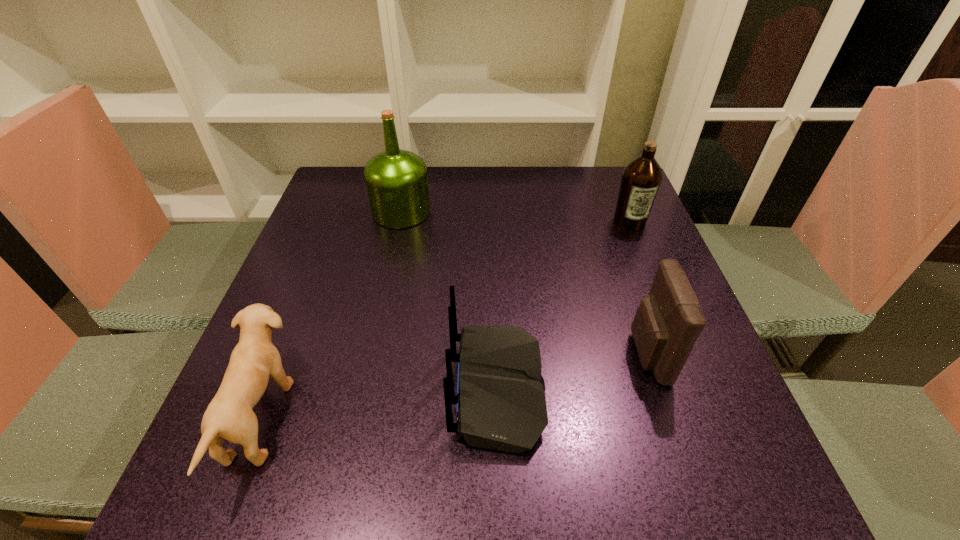
Point out which object is positioned as the second nearest to the third object from left to right. Please provide its 2D coordinates. Your answer should be formatted as a tuple, i.e. [(x, y)], where the tuple contains the x and y coordinates of a point satisfying the conditions above.

[(229, 415)]

You are a GUI agent. You are given a task and a screenshot of the screen. Output one action in this format:
    pyautogui.click(x=<x>, y=<y>)
    Task: Click on the object that is the fourth nearest to the shorter olive oil
    Image resolution: width=960 pixels, height=540 pixels.
    Given the screenshot: What is the action you would take?
    pyautogui.click(x=229, y=415)

This screenshot has height=540, width=960. I want to click on vacant point that satisfies the following two spatial constraints: 1. on the label of the right olive oil; 2. on the back of the router, so click(697, 389).

Image resolution: width=960 pixels, height=540 pixels. I want to click on free space that satisfies the following two spatial constraints: 1. on the label of the shorter olive oil; 2. with an open flap on the pouch, so click(684, 354).

Locate an element on the screen. This screenshot has width=960, height=540. vacant space that satisfies the following two spatial constraints: 1. on the label of the shorter olive oil; 2. with an open flap on the pouch is located at coordinates (684, 354).